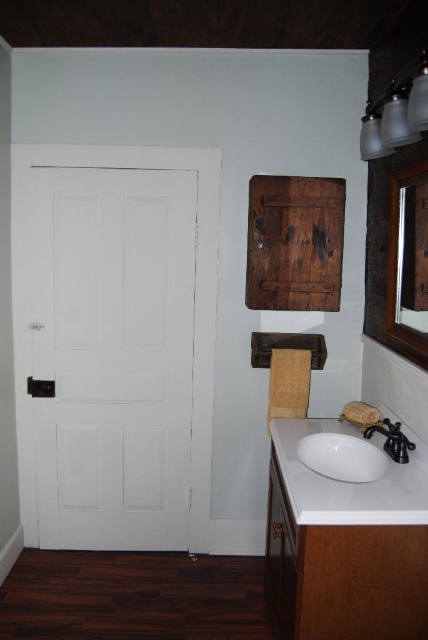
Does white glossy sink at lower center have a smaller size compared to black matte faucet at lower right?

No.

Is point (311, 458) in front of point (392, 445)?

That is False.

Who is more distant from viewer, (350, 461) or (383, 433)?

The point (350, 461) is behind.

You are a GUI agent. You are given a task and a screenshot of the screen. Output one action in this format:
    pyautogui.click(x=<x>, y=<y>)
    Task: Click on the white glossy sink at lower center
    
    Given the screenshot: What is the action you would take?
    pyautogui.click(x=341, y=458)

Is wooden mirror at upper right to the right of black matte faucet at lower right from the viewer's perspective?

Correct, you'll find wooden mirror at upper right to the right of black matte faucet at lower right.

Is wooden mirror at upper right wider than black matte faucet at lower right?

In fact, wooden mirror at upper right might be narrower than black matte faucet at lower right.

Is point (422, 289) farther from viewer compared to point (392, 452)?

Yes, it is behind point (392, 452).

Locate an element on the screen. The width and height of the screenshot is (428, 640). wooden mirror at upper right is located at coordinates (407, 252).

Describe the element at coordinates (112, 355) in the screenshot. This screenshot has height=640, width=428. I see `white matte door at left` at that location.

Is point (86, 529) in front of point (427, 188)?

No, (86, 529) is behind (427, 188).

Which is in front, point (41, 209) or point (425, 193)?

Point (425, 193) is in front.

I want to click on white matte door at left, so click(x=112, y=355).